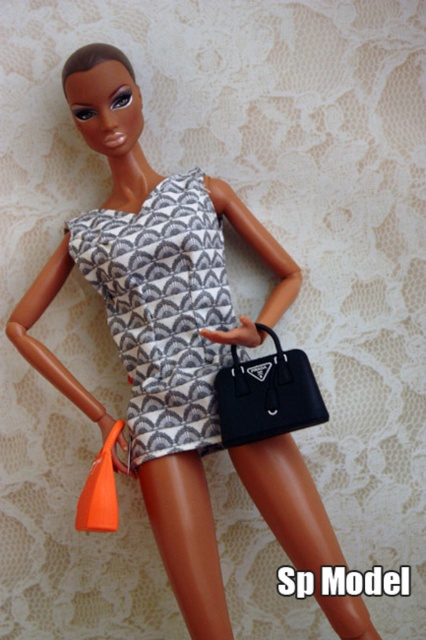
Question: Where is quilted gray dress at center located in relation to matte black handbag at lower center in the image?

Choices:
 (A) above
 (B) below

Answer: (A)

Question: Is quilted gray dress at center further to the viewer compared to matte black handbag at lower center?

Choices:
 (A) no
 (B) yes

Answer: (B)

Question: Does quilted gray dress at center lie in front of matte black handbag at lower center?

Choices:
 (A) no
 (B) yes

Answer: (A)